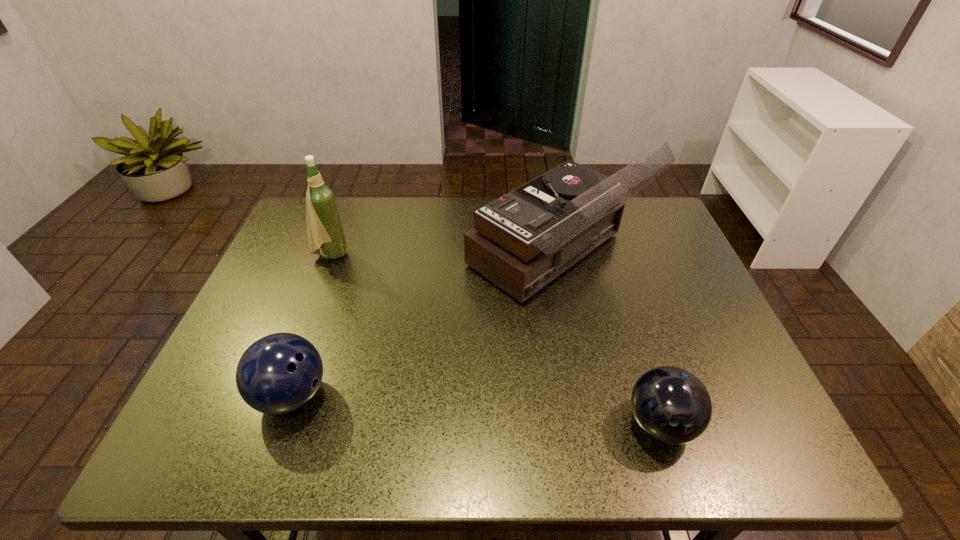
Where is `object that ranks as the closest to the record player`? The height and width of the screenshot is (540, 960). object that ranks as the closest to the record player is located at coordinates (670, 404).

Image resolution: width=960 pixels, height=540 pixels. What are the coordinates of `object that is the closest to the right bowling ball` in the screenshot? It's located at (522, 241).

Where is `vacant space that satisfies the following two spatial constraints: 1. on the front side of the record player; 2. on the surface of the left bowling ball near the finger holes`? The height and width of the screenshot is (540, 960). vacant space that satisfies the following two spatial constraints: 1. on the front side of the record player; 2. on the surface of the left bowling ball near the finger holes is located at coordinates (581, 395).

I want to click on free point that satisfies the following two spatial constraints: 1. on the front-facing side of the record player; 2. on the right side of the wine bottle, so click(x=331, y=255).

Locate an element on the screen. The height and width of the screenshot is (540, 960). free spot that satisfies the following two spatial constraints: 1. on the front-facing side of the record player; 2. on the left side of the wine bottle is located at coordinates (331, 255).